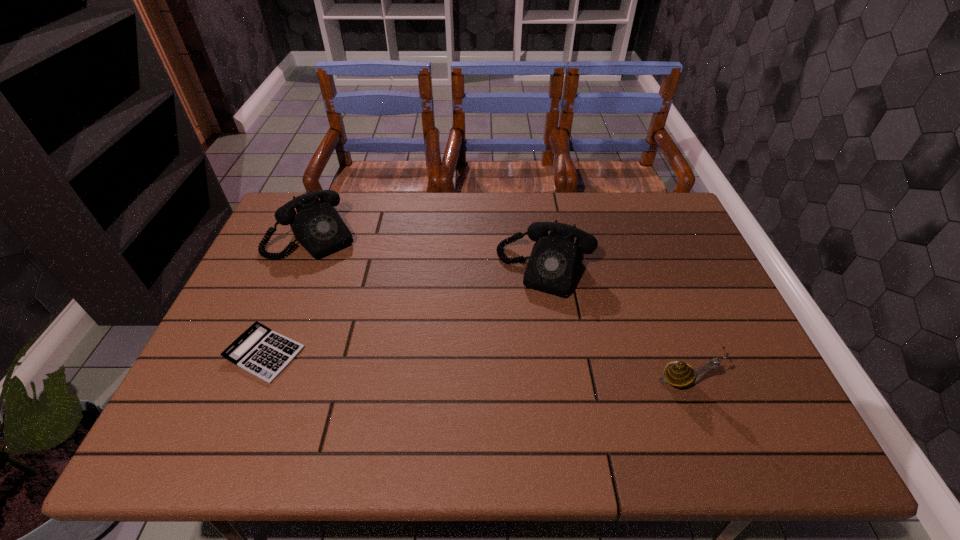
Where is `empty space between the second object from right to left and the left telephone`? This screenshot has width=960, height=540. empty space between the second object from right to left and the left telephone is located at coordinates (429, 253).

This screenshot has height=540, width=960. Identify the location of vacant area that lies between the left telephone and the rightmost object. (498, 308).

Locate an element on the screen. The image size is (960, 540). free space between the left telephone and the calculator is located at coordinates (288, 295).

This screenshot has width=960, height=540. What are the coordinates of `vacant area that lies between the second object from right to left and the rightmost object` in the screenshot? It's located at (614, 325).

What are the coordinates of `free space between the left telephone and the third object from left to right` in the screenshot? It's located at (429, 253).

Image resolution: width=960 pixels, height=540 pixels. I want to click on empty space that is in between the rightmost object and the shortest object, so click(x=474, y=367).

Identify the location of free spot between the rightmost object and the calculator. The image size is (960, 540). (474, 367).

Where is `free space between the snail and the shortest object`? Image resolution: width=960 pixels, height=540 pixels. free space between the snail and the shortest object is located at coordinates (474, 367).

Locate which object ranks third in proximity to the right telephone. Please provide its 2D coordinates. Your answer should be formatted as a tuple, i.e. [(x, y)], where the tuple contains the x and y coordinates of a point satisfying the conditions above.

[(259, 350)]

The image size is (960, 540). What are the coordinates of `object that can be found as the closest to the right telephone` in the screenshot? It's located at (679, 374).